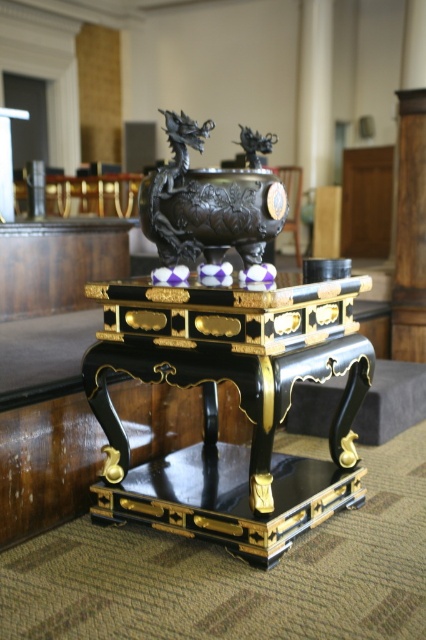
You are a delivery person who needs to place a small package on the surface between the black lacquer table at center and the black polished metal dragon at center. Can you fit the package if it measures 10 inches in length?

The distance between the black lacquer table at center and the black polished metal dragon at center is 19.11 inches. Since the package is only 10 inches long, it can easily fit in the space between them.

You are standing in front of the traditional Japanese incense burner setup. There are two points marked in the image, point [215,301] and point [180,173]. Which point is closer to you?

Point [215,301] is in front of point [180,173], so it is closer to you.

Where is the black lacquer table at center located in the image?

The black lacquer table at center is located at point [239,404] in the image.